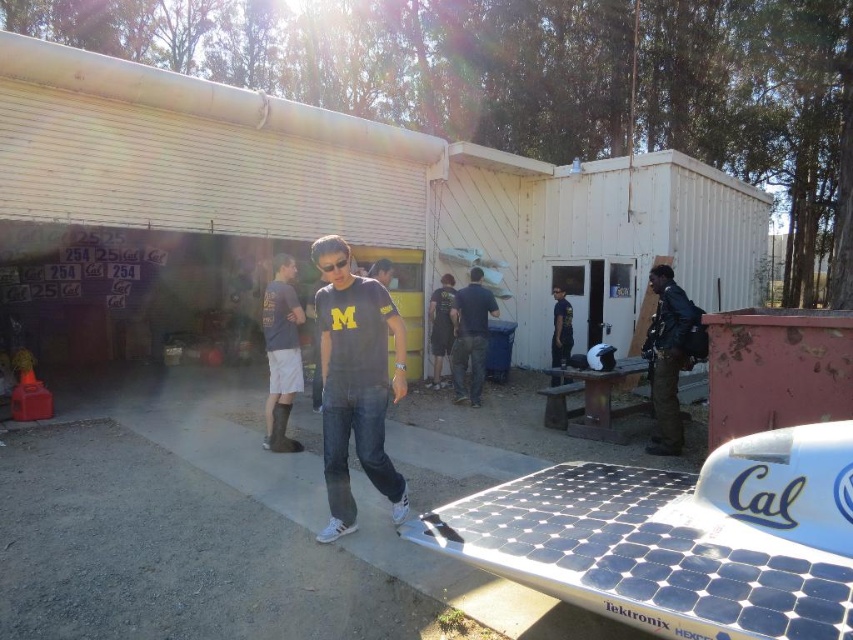
You are a photographer trying to capture a clear shot of the dark blue jeans at center and dark blue shirt at center. Since the scene is crowded, you need to adjust your camera focus. Which object should you focus on first if you want to ensure the smaller one is in sharp focus?

The dark blue jeans at center has a smaller size compared to dark blue shirt at center. Therefore, you should focus on the dark blue jeans at center first to ensure its sharpness since smaller objects often require precise focus to capture details clearly.